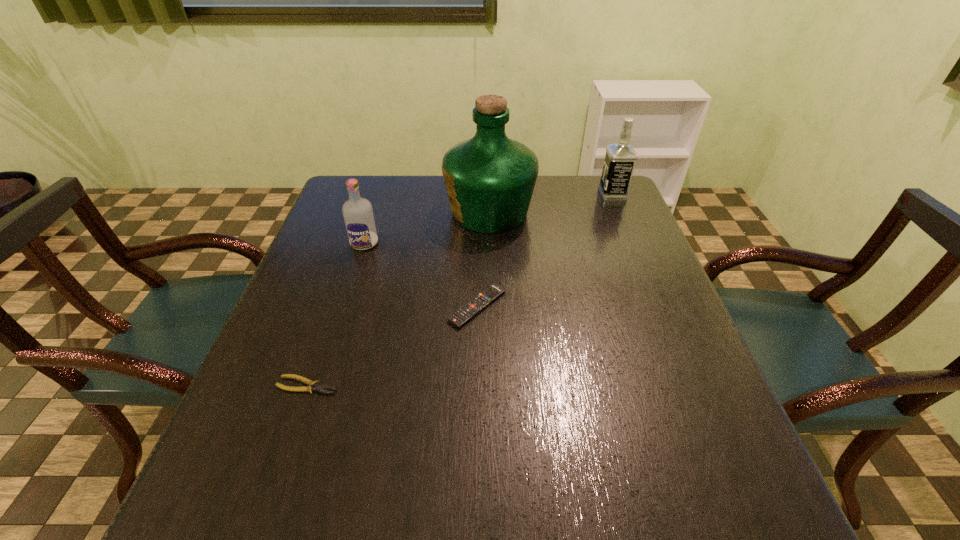
The image size is (960, 540). I want to click on vacant region located 0.150m on the label side of the liquor, so click(392, 212).

Find the location of `vacant space located on the label side of the liquor`. vacant space located on the label side of the liquor is located at coordinates pyautogui.click(x=423, y=212).

Where is `vacant region located 0.400m on the front label of the right vodka`? This screenshot has height=540, width=960. vacant region located 0.400m on the front label of the right vodka is located at coordinates (468, 194).

Identify the location of free space located on the front label of the right vodka. (561, 194).

Image resolution: width=960 pixels, height=540 pixels. What are the coordinates of `vacant space located 0.050m on the front label of the right vodka` in the screenshot? It's located at (584, 194).

Where is `vacant space located on the label of the left vodka`? The image size is (960, 540). vacant space located on the label of the left vodka is located at coordinates (325, 367).

The width and height of the screenshot is (960, 540). Identify the location of vacant space situated on the front of the second shortest object. (476, 489).

You are a GUI agent. You are given a task and a screenshot of the screen. Output one action in this format:
    pyautogui.click(x=<x>, y=<y>)
    Task: Click on the vacant point located 0.050m on the right of the shortest object
    
    Given the screenshot: What is the action you would take?
    pyautogui.click(x=365, y=385)

The image size is (960, 540). Identify the location of liquor that is at the far edge. (489, 178).

Locate an element on the screen. The width and height of the screenshot is (960, 540). vodka at the far edge is located at coordinates (620, 158).